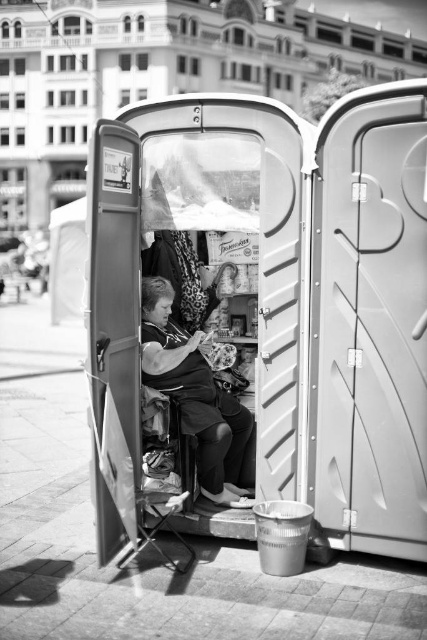
You are a sanitation worker responsible for maintaining the portable toilet at a busy outdoor event. You need to clean the plastic portable toilet at center, but there is a matte black fabric woman at center inside it. Can you safely enter the toilet to clean it while she is present?

The plastic portable toilet at center is 1.83 meters away from matte black fabric woman at center. Since the distance between them is significant, you can safely enter the toilet to clean it while she is present without disturbing her.

You are standing in front of the plastic portable toilet at center and want to reach the matte black fabric woman at center inside it. Can you directly touch her without moving any objects?

The plastic portable toilet at center is closer to the viewer than the matte black fabric woman at center, so you cannot directly touch her without moving the toilet itself.

You are standing outside the portable toilet unit and notice two points inside. The first point is at coordinates point [91,241] and the second is at point [213,444]. Which of these points is nearer to you?

Point [91,241] is closer to the viewer than point [213,444].